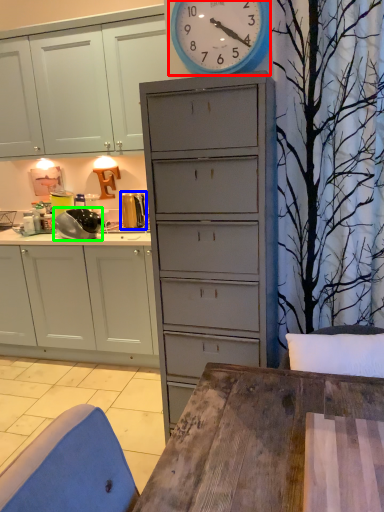
Question: Which object is positioned closest to wall clock (highlighted by a red box)? Select from appliance (highlighted by a blue box) and appliance (highlighted by a green box).

Choices:
 (A) appliance
 (B) appliance

Answer: (B)